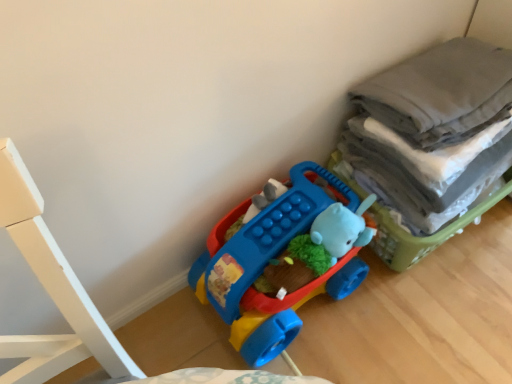
Question: Considering the positions of gray cotton laundry at right and matte plastic toy car at center in the image, is gray cotton laundry at right taller or shorter than matte plastic toy car at center?

Choices:
 (A) tall
 (B) short

Answer: (A)

Question: In the image, is gray cotton laundry at right on the left side or the right side of matte plastic toy car at center?

Choices:
 (A) left
 (B) right

Answer: (B)

Question: Choose the correct answer: Is gray cotton laundry at right inside matte plastic toy car at center or outside it?

Choices:
 (A) outside
 (B) inside

Answer: (A)

Question: Is point (205, 273) closer or farther from the camera than point (465, 87)?

Choices:
 (A) farther
 (B) closer

Answer: (A)

Question: Is matte plastic toy car at center inside or outside of gray cotton laundry at right?

Choices:
 (A) outside
 (B) inside

Answer: (A)

Question: Looking at their shapes, would you say matte plastic toy car at center is wider or thinner than gray cotton laundry at right?

Choices:
 (A) wide
 (B) thin

Answer: (B)

Question: Visually, is matte plastic toy car at center positioned to the left or to the right of gray cotton laundry at right?

Choices:
 (A) right
 (B) left

Answer: (B)